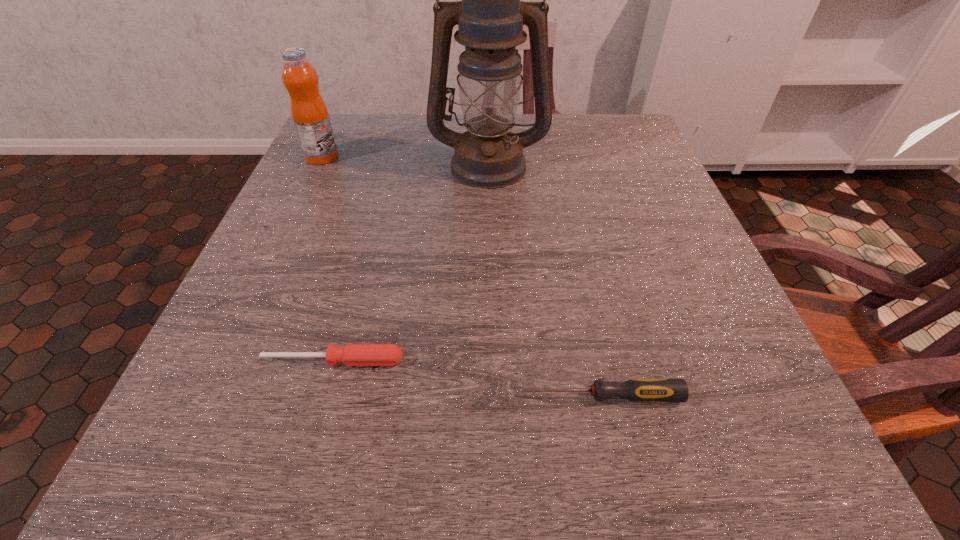
Find the location of a particular element. The width and height of the screenshot is (960, 540). the tallest object is located at coordinates (490, 18).

Where is `the second tallest object`? The width and height of the screenshot is (960, 540). the second tallest object is located at coordinates (309, 111).

At what (x,y) coordinates should I click in order to perform the action: click on the leftmost object. Please return your answer as a coordinate pair (x, y). The width and height of the screenshot is (960, 540). Looking at the image, I should click on (309, 111).

Identify the location of the nearer screwdriver. This screenshot has height=540, width=960. (640, 390).

This screenshot has height=540, width=960. I want to click on the nearest object, so click(640, 390).

In order to click on the second nearest object in this screenshot , I will do `click(352, 354)`.

I want to click on the farther screwdriver, so click(352, 354).

Locate an element on the screen. Image resolution: width=960 pixels, height=540 pixels. vacant position located on the front of the tallest object is located at coordinates point(490,215).

This screenshot has height=540, width=960. What are the coordinates of `vacant space located 0.120m on the back of the leftmost object` in the screenshot? It's located at (338, 125).

Where is `vacant space located 0.390m insert the nearest object into a screw head`? Image resolution: width=960 pixels, height=540 pixels. vacant space located 0.390m insert the nearest object into a screw head is located at coordinates [229, 396].